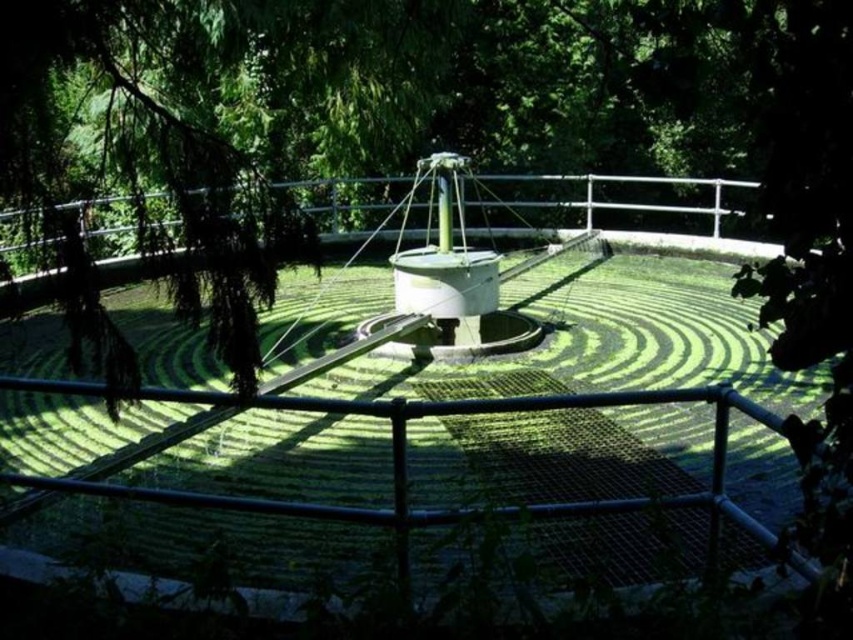
You are a maintenance worker needing to reach the green grass at center from the metallic silver rail at center. Can you step directly from one to the other without any tools?

The distance between the green grass at center and the metallic silver rail at center is 9.75 meters, which is too far to step directly without assistance. You would need a ladder or bridge to cross the gap.

From the picture: You are a maintenance worker needing to access the central tank for inspection. You see the green grass at center and the metallic silver rail at center. Which object is closer to you, and why can this affect your path?

The green grass at center is closer to you than the metallic silver rail at center. This means you must navigate around or over the grass first before reaching the rail, which may require specific safety precautions or tools to access the tank safely.